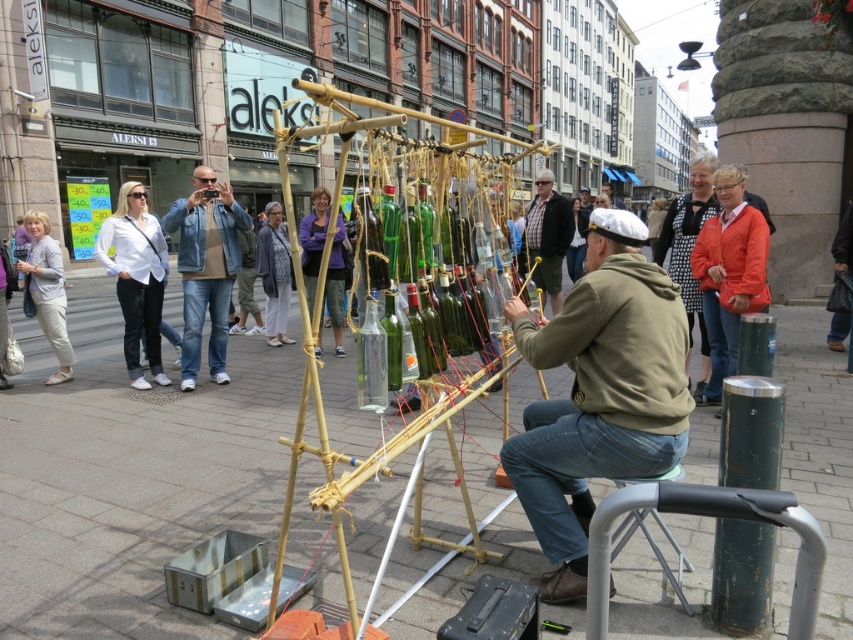
Question: Which object appears closest to the camera in this image?

Choices:
 (A) bamboo structure at center
 (B) white cotton shirt at left
 (C) purple fabric at center

Answer: (A)

Question: Does smooth concrete pavement at center appear on the left side of checkered fabric shirt at center?

Choices:
 (A) no
 (B) yes

Answer: (B)

Question: Which point is farther from the camera taking this photo?

Choices:
 (A) (561, 259)
 (B) (308, 301)

Answer: (B)

Question: Can you confirm if orange fabric jacket at upper right is positioned to the right of light gray sweater at center?

Choices:
 (A) no
 (B) yes

Answer: (B)

Question: Observing the image, what is the correct spatial positioning of khaki cotton jacket at center in reference to white cotton shirt at left?

Choices:
 (A) below
 (B) above

Answer: (A)

Question: Which point appears closest to the camera in this image?

Choices:
 (A) (321, 349)
 (B) (552, 250)
 (C) (552, 600)

Answer: (C)